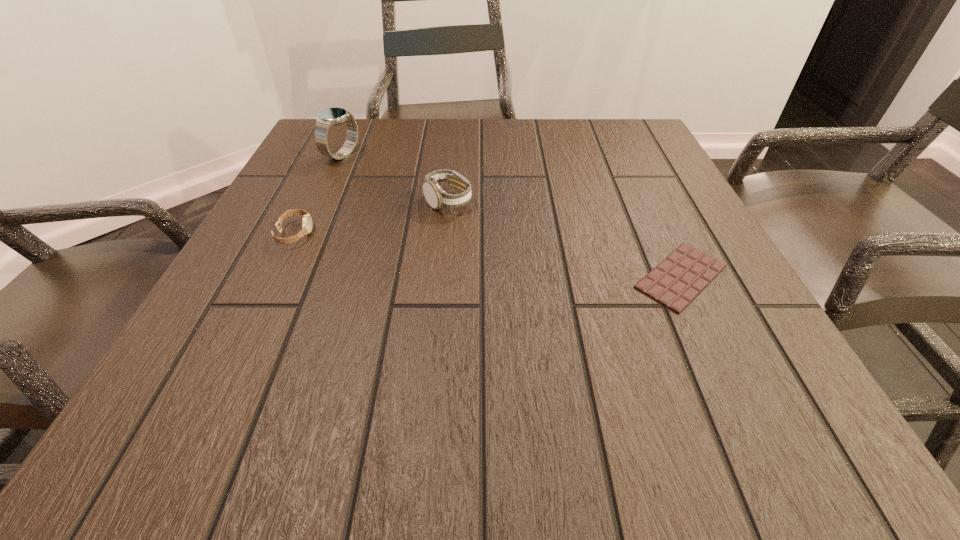
Locate an element on the screen. vacant position located on the face of the shortest watch is located at coordinates (385, 234).

This screenshot has width=960, height=540. Find the location of `free space located 0.370m on the left of the rightmost object`. free space located 0.370m on the left of the rightmost object is located at coordinates (412, 276).

I want to click on object at the far edge, so click(x=328, y=117).

Locate an element on the screen. object at the right edge is located at coordinates (681, 276).

I want to click on object that is at the far left corner, so click(x=328, y=117).

In the image, there is a desktop. Where is `vacant space at the far edge`? This screenshot has height=540, width=960. vacant space at the far edge is located at coordinates (445, 136).

Image resolution: width=960 pixels, height=540 pixels. I want to click on vacant position at the near edge of the desktop, so click(x=514, y=444).

The image size is (960, 540). In order to click on free space at the left edge of the desktop in this screenshot , I will do `click(240, 325)`.

Where is `vacant space at the right edge`? This screenshot has height=540, width=960. vacant space at the right edge is located at coordinates (710, 298).

Identify the location of vacant space at the far left corner. (347, 138).